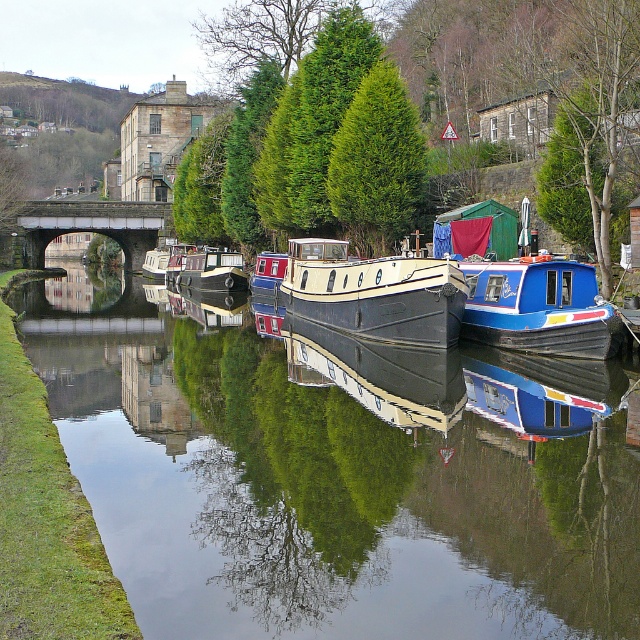
Does blue glossy boat at right appear on the right side of white glossy canal boat at center?

Yes, blue glossy boat at right is to the right of white glossy canal boat at center.

Is point (531, 275) less distant than point (232, 252)?

Yes, it is.

Is point (502, 316) less distant than point (221, 256)?

Yes, it is.

Locate an element on the screen. This screenshot has height=640, width=640. blue glossy boat at right is located at coordinates (538, 307).

Between smooth water at center and white glossy canal boat at center, which one is positioned lower?

smooth water at center

Can you confirm if smooth water at center is positioned to the right of white glossy canal boat at center?

Indeed, smooth water at center is positioned on the right side of white glossy canal boat at center.

You are a GUI agent. You are given a task and a screenshot of the screen. Output one action in this format:
    pyautogui.click(x=<x>, y=<y>)
    Task: Click on the smooth water at center
    Image resolution: width=640 pixels, height=640 pixels.
    Given the screenshot: What is the action you would take?
    pyautogui.click(x=337, y=472)

What do you see at coordinates (374, 292) in the screenshot?
I see `matte black barge at center` at bounding box center [374, 292].

Is point (316, 320) in front of point (44, 220)?

That is True.

Find the location of a particular element. The width and height of the screenshot is (640, 640). matte black barge at center is located at coordinates (374, 292).